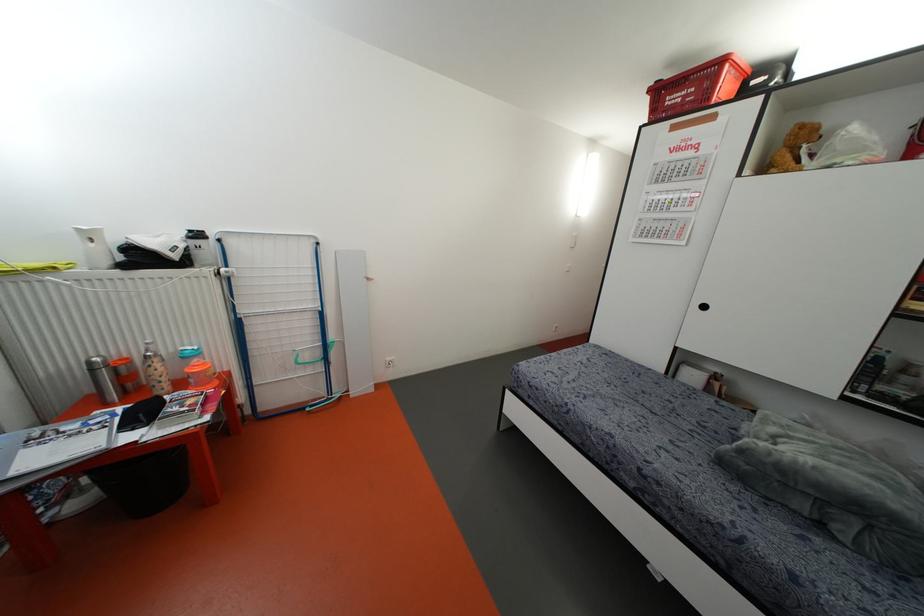
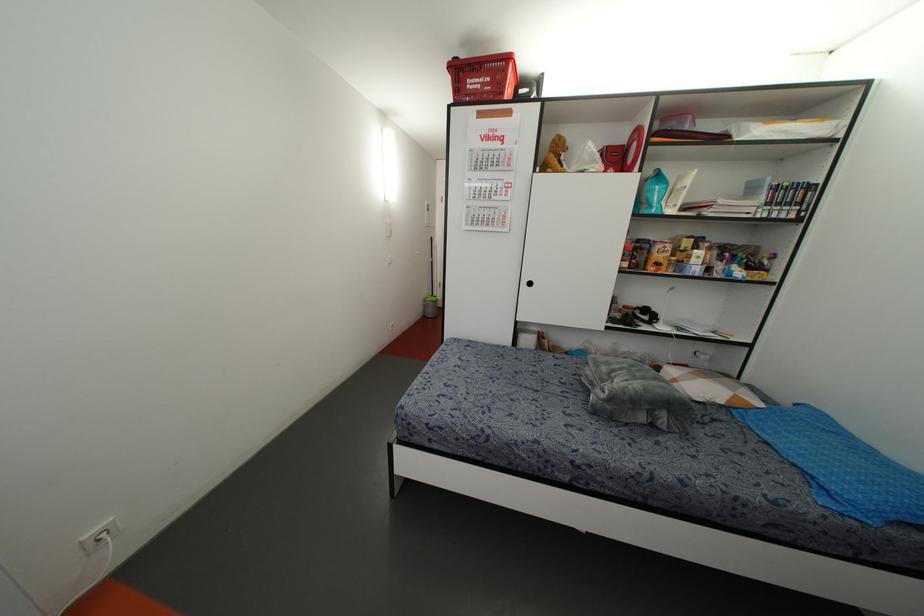
Question: The camera is either moving clockwise (left) or counter-clockwise (right) around the object. The first image is from the beginning of the video and the second image is from the end. Is the camera moving left or right when shooting the video?

Choices:
 (A) Left
 (B) Right

Answer: (A)